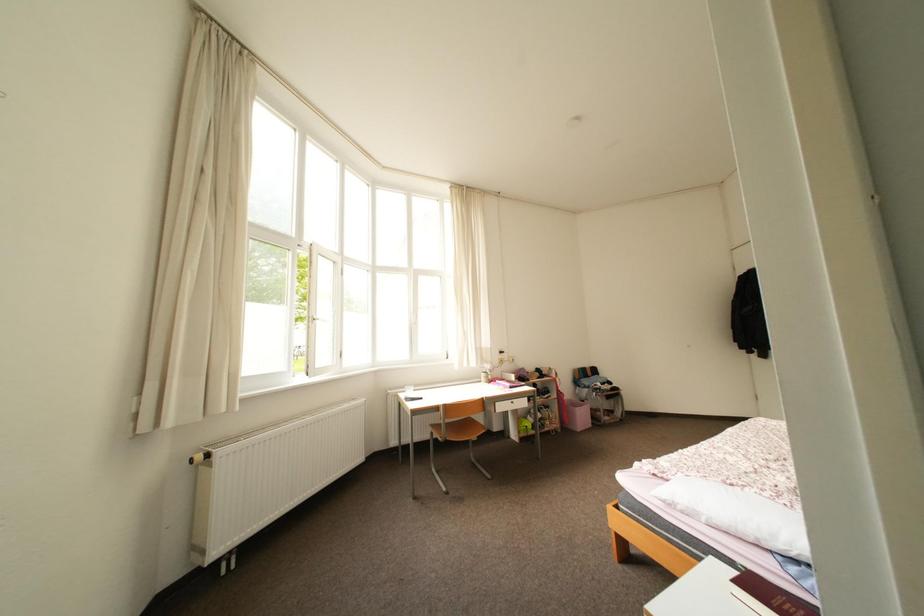
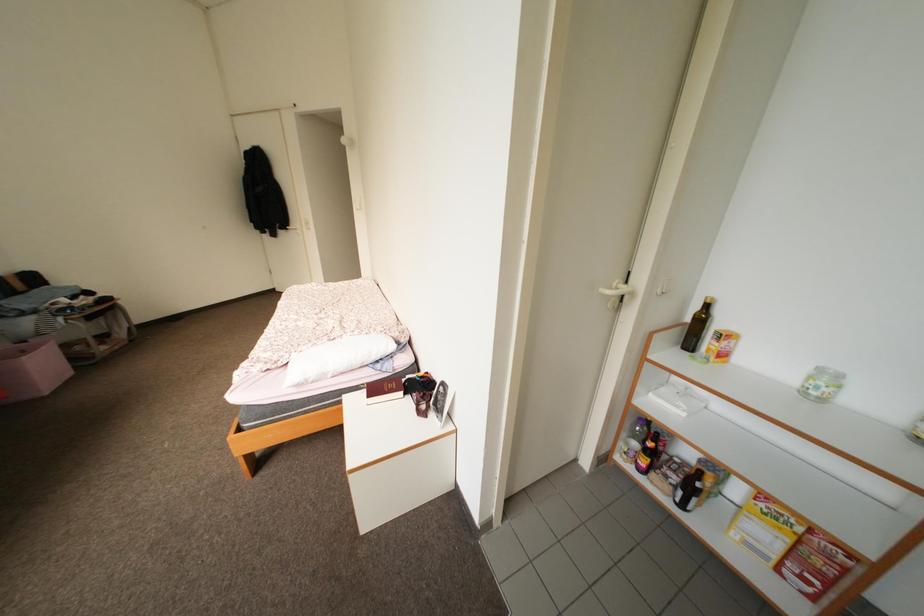
Based on the continuous images, in which direction is the camera rotating?

The rotation direction of the camera is right-down.